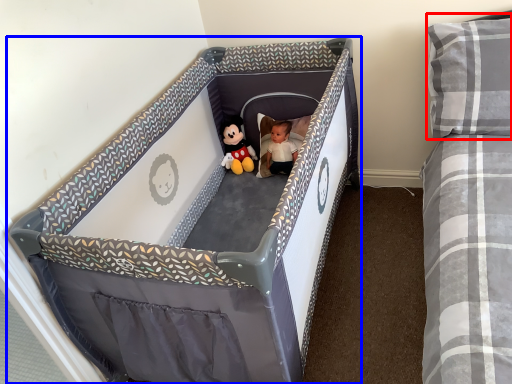
Question: Which object appears closest to the camera in this image, pillow (highlighted by a red box) or infant bed (highlighted by a blue box)?

Choices:
 (A) pillow
 (B) infant bed

Answer: (B)